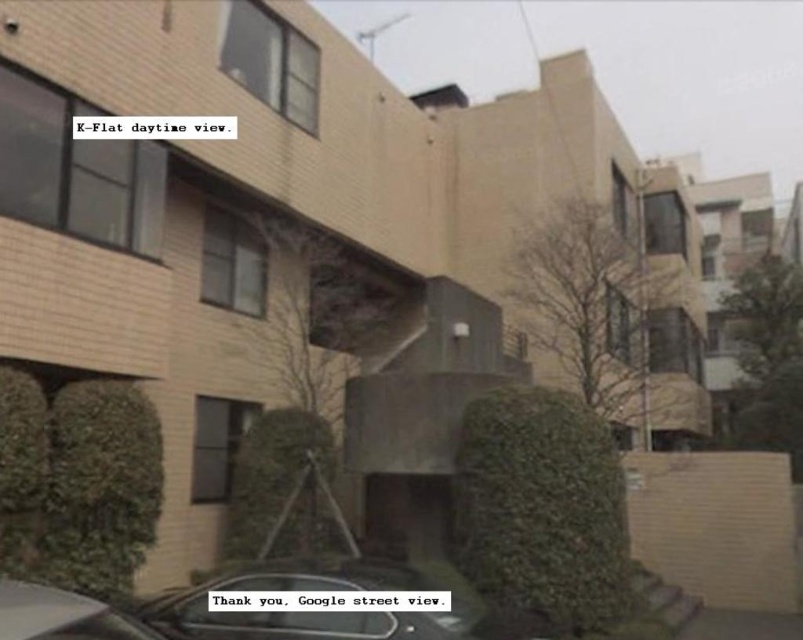
Which of these two, metallic gray car at lower center or shiny silver car at lower left, stands shorter?

Standing shorter between the two is metallic gray car at lower center.

This screenshot has width=803, height=640. Describe the element at coordinates (300, 611) in the screenshot. I see `metallic gray car at lower center` at that location.

This screenshot has height=640, width=803. What are the coordinates of `metallic gray car at lower center` in the screenshot? It's located at (300, 611).